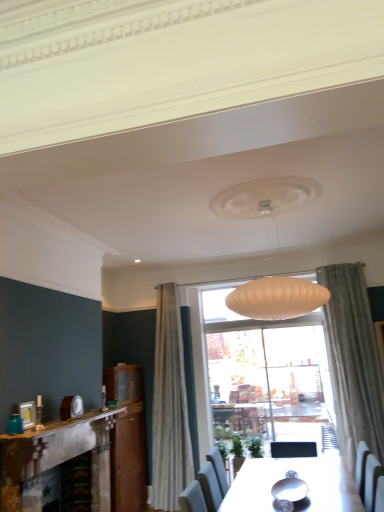
Question: Considering the relative sizes of rustic stone fireplace at left and teal glass jar at left in the image provided, is rustic stone fireplace at left wider than teal glass jar at left?

Choices:
 (A) yes
 (B) no

Answer: (A)

Question: Is rustic stone fireplace at left oriented towards teal glass jar at left?

Choices:
 (A) yes
 (B) no

Answer: (B)

Question: Is rustic stone fireplace at left located outside teal glass jar at left?

Choices:
 (A) yes
 (B) no

Answer: (A)

Question: Can you confirm if rustic stone fireplace at left is bigger than teal glass jar at left?

Choices:
 (A) no
 (B) yes

Answer: (B)

Question: Does rustic stone fireplace at left have a lesser height compared to teal glass jar at left?

Choices:
 (A) yes
 (B) no

Answer: (B)

Question: Is rustic stone fireplace at left further to the viewer compared to teal glass jar at left?

Choices:
 (A) no
 (B) yes

Answer: (A)

Question: Is white marble fireplace at lower left not near teal glass jar at left?

Choices:
 (A) no
 (B) yes

Answer: (A)

Question: Could teal glass jar at left be considered to be inside white marble fireplace at lower left?

Choices:
 (A) yes
 (B) no

Answer: (B)

Question: Is white marble fireplace at lower left further to camera compared to teal glass jar at left?

Choices:
 (A) no
 (B) yes

Answer: (A)

Question: Would you say white marble fireplace at lower left is outside teal glass jar at left?

Choices:
 (A) no
 (B) yes

Answer: (B)

Question: From a real-world perspective, is white marble fireplace at lower left positioned under teal glass jar at left based on gravity?

Choices:
 (A) no
 (B) yes

Answer: (B)

Question: Does white marble fireplace at lower left have a smaller size compared to teal glass jar at left?

Choices:
 (A) yes
 (B) no

Answer: (B)

Question: Is the position of rustic stone fireplace at left more distant than that of white marble fireplace at lower left?

Choices:
 (A) no
 (B) yes

Answer: (A)